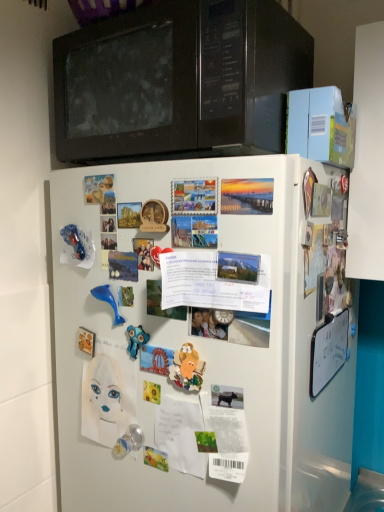
Question: Can you confirm if matte plastic toy at center, the 1th toy from the right, is smaller than matte paper poster at upper left, positioned as the 2th poster in front-to-back order?

Choices:
 (A) yes
 (B) no

Answer: (A)

Question: From the image's perspective, is matte plastic toy at center, the fourth toy in the left-to-right sequence, located above matte paper poster at upper left, which ranks as the first poster in left-to-right order?

Choices:
 (A) yes
 (B) no

Answer: (B)

Question: Can you confirm if matte plastic toy at center, which is the third toy from top to bottom, is wider than matte paper poster at upper left, which is the 1th poster from back to front?

Choices:
 (A) no
 (B) yes

Answer: (A)

Question: Is matte plastic toy at center, the 1th toy from the right, not within matte paper poster at upper left, which appears as the 2th poster when ordered from the bottom?

Choices:
 (A) no
 (B) yes

Answer: (B)

Question: Is matte plastic toy at center, which is the third toy from top to bottom, at the left side of matte paper poster at upper left, the 1th poster viewed from the top?

Choices:
 (A) no
 (B) yes

Answer: (A)

Question: Is matte plastic toy at center, which is the third toy from top to bottom, beside matte paper poster at upper left, acting as the second poster starting from the right?

Choices:
 (A) no
 (B) yes

Answer: (A)

Question: Would you say black matte microwave at upper center contains white paper at center, which ranks as the first poster in front-to-back order?

Choices:
 (A) yes
 (B) no

Answer: (B)

Question: Does black matte microwave at upper center turn towards white paper at center, placed as the second poster when sorted from back to front?

Choices:
 (A) no
 (B) yes

Answer: (A)

Question: Are black matte microwave at upper center and white paper at center, which appears as the second poster when viewed from the top, located far from each other?

Choices:
 (A) no
 (B) yes

Answer: (A)

Question: Can you confirm if black matte microwave at upper center is shorter than white paper at center, positioned as the 1th poster in right-to-left order?

Choices:
 (A) yes
 (B) no

Answer: (B)

Question: Is black matte microwave at upper center smaller than white paper at center, placed as the second poster when sorted from back to front?

Choices:
 (A) no
 (B) yes

Answer: (A)

Question: From a real-world perspective, is black matte microwave at upper center physically below white paper at center, which appears as the second poster when viewed from the top?

Choices:
 (A) yes
 (B) no

Answer: (B)

Question: Is blue rubber dolphin at center-left, which is the fourth toy in right-to-left order, with transparent plastic toy at lower center, which is counted as the 4th toy, starting from the top?

Choices:
 (A) yes
 (B) no

Answer: (B)